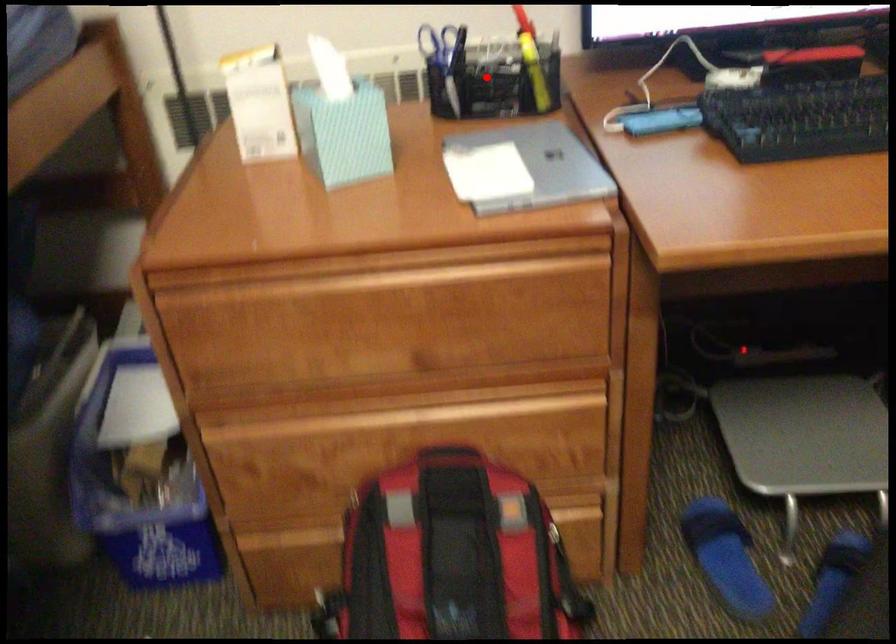
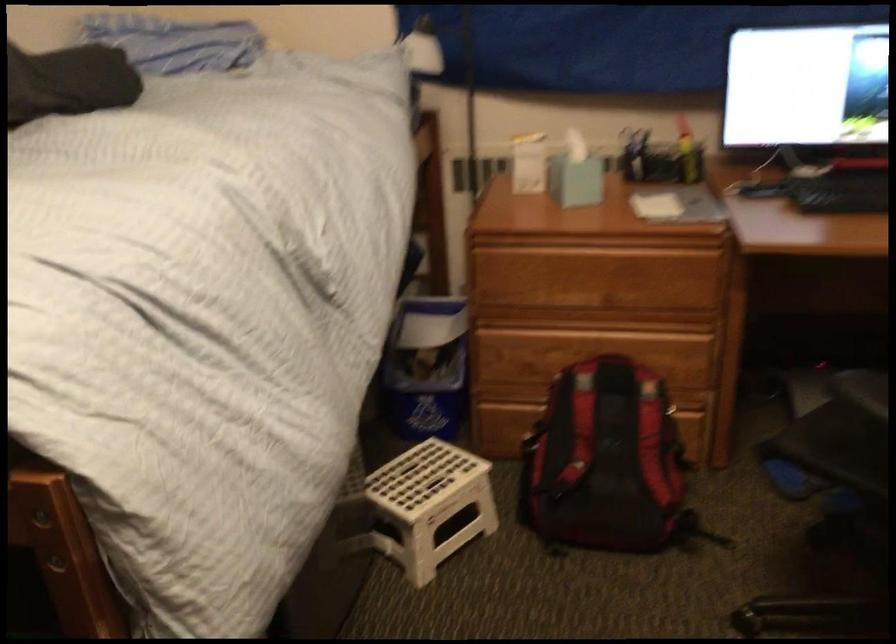
Question: I am providing you with two images of the same scene from different viewpoints. Image1 has a red point marked. In image2, the corresponding 3D location appears at what relative position? Reply with the corresponding letter.

Choices:
 (A) Closer
 (B) Farther

Answer: (B)